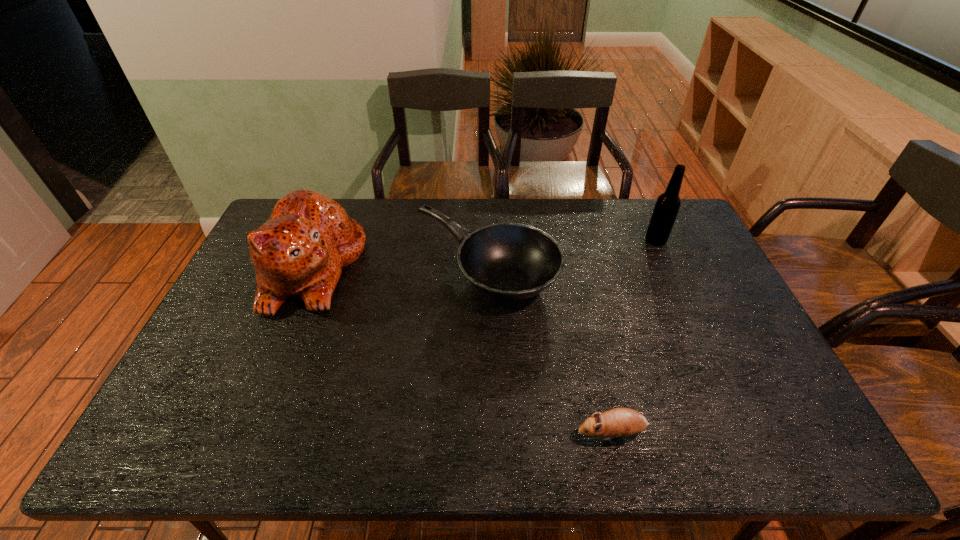
Find the location of a particular element. the leftmost object is located at coordinates (300, 251).

You are a GUI agent. You are given a task and a screenshot of the screen. Output one action in this format:
    pyautogui.click(x=<x>, y=<y>)
    Task: Click on the beer bottle
    The width and height of the screenshot is (960, 540).
    Given the screenshot: What is the action you would take?
    pyautogui.click(x=667, y=205)

Locate an element on the screen. This screenshot has height=540, width=960. the second shortest object is located at coordinates (507, 261).

Locate an element on the screen. The width and height of the screenshot is (960, 540). hamster is located at coordinates (619, 422).

The height and width of the screenshot is (540, 960). I want to click on the nearest object, so click(619, 422).

Where is `vacant position located on the face of the leftmost object`? This screenshot has height=540, width=960. vacant position located on the face of the leftmost object is located at coordinates (455, 267).

In order to click on blank area located on the left of the beer bottle in this screenshot , I will do point(557,240).

Find the location of a particular element. Image resolution: width=960 pixels, height=540 pixels. free location located 0.220m on the front of the second shortest object is located at coordinates (488, 389).

Locate an element on the screen. vacant space located 0.250m at the face of the nearest object is located at coordinates pos(466,433).

At what (x,y) coordinates should I click in order to perform the action: click on vacant region located 0.400m at the face of the nearest object. Please return your answer as a coordinate pair (x, y). This screenshot has height=540, width=960. Looking at the image, I should click on (399, 433).